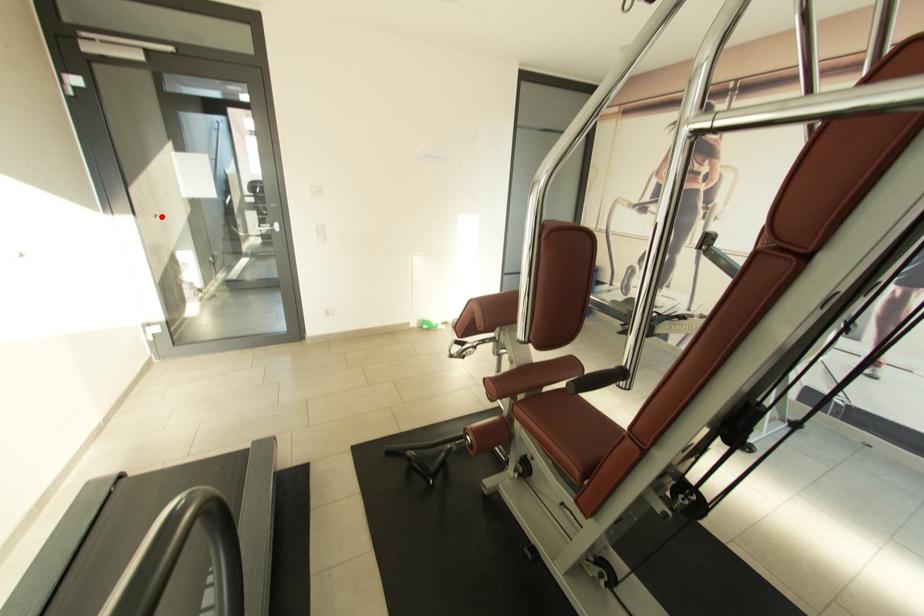
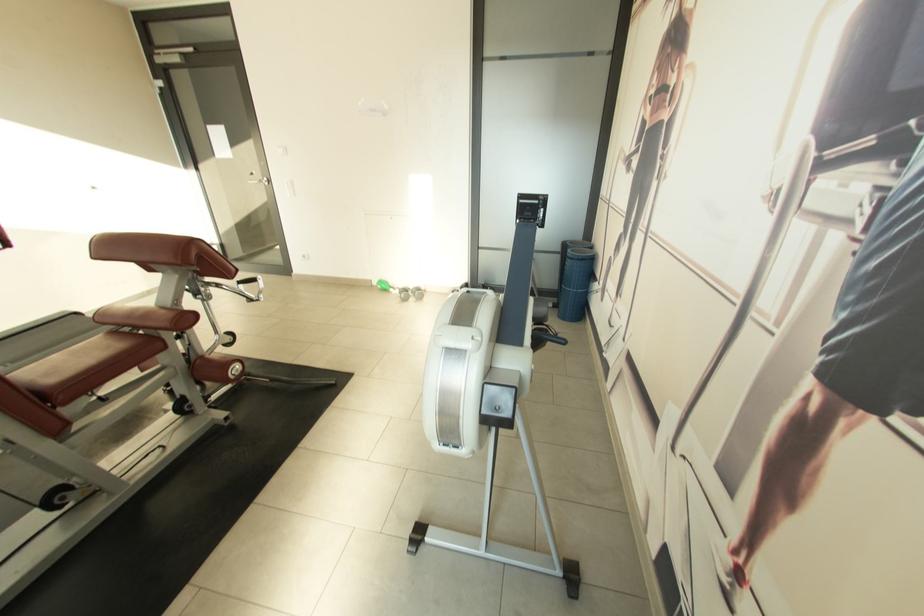
The point at the highlighted location is marked in the first image. Where is the corresponding point in the second image?

(258, 175)